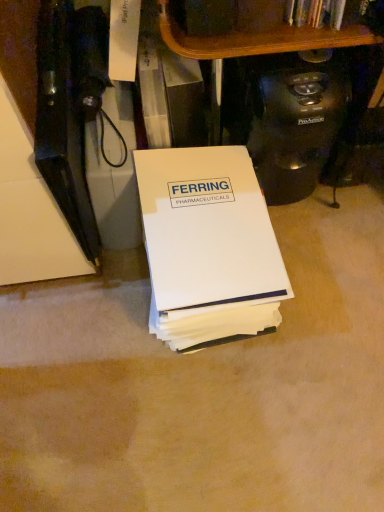
This screenshot has height=512, width=384. Describe the element at coordinates (208, 245) in the screenshot. I see `white paper at center` at that location.

Locate an element on the screen. white paper at center is located at coordinates (208, 245).

Identify the location of white paper at center. (208, 245).